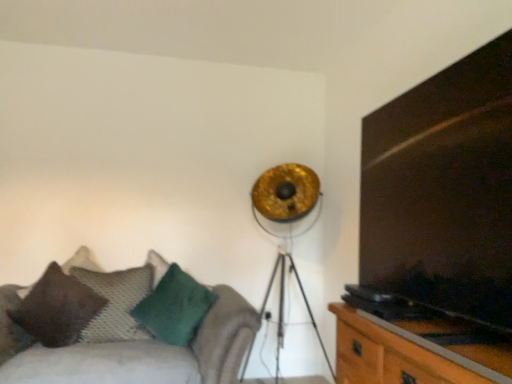
Question: Considering their positions, is green fuzzy pillow at lower left, positioned as the 3th pillow in left-to-right order, located in front of or behind gold metallic tripod lamp at upper center?

Choices:
 (A) front
 (B) behind

Answer: (B)

Question: In terms of height, does green fuzzy pillow at lower left, the 1th pillow from the right, look taller or shorter compared to gold metallic tripod lamp at upper center?

Choices:
 (A) short
 (B) tall

Answer: (A)

Question: Considering the real-world distances, which object is farthest from the brown textured pillow at lower left, positioned as the third pillow in right-to-left order?

Choices:
 (A) knitted fabric pillow at left, the 2th pillow when ordered from left to right
 (B) green fuzzy pillow at lower left, positioned as the 3th pillow in left-to-right order
 (C) velvet green cushion at lower left
 (D) gold metallic tripod lamp at upper center
 (E) wooden cabinet at right

Answer: (E)

Question: Which object is positioned closest to the dark wood entertainment center at right?

Choices:
 (A) velvet green cushion at lower left
 (B) knitted fabric pillow at left, the 2th pillow when ordered from left to right
 (C) brown textured pillow at lower left, positioned as the third pillow in right-to-left order
 (D) green fuzzy pillow at lower left, positioned as the 3th pillow in left-to-right order
 (E) wooden cabinet at right

Answer: (E)